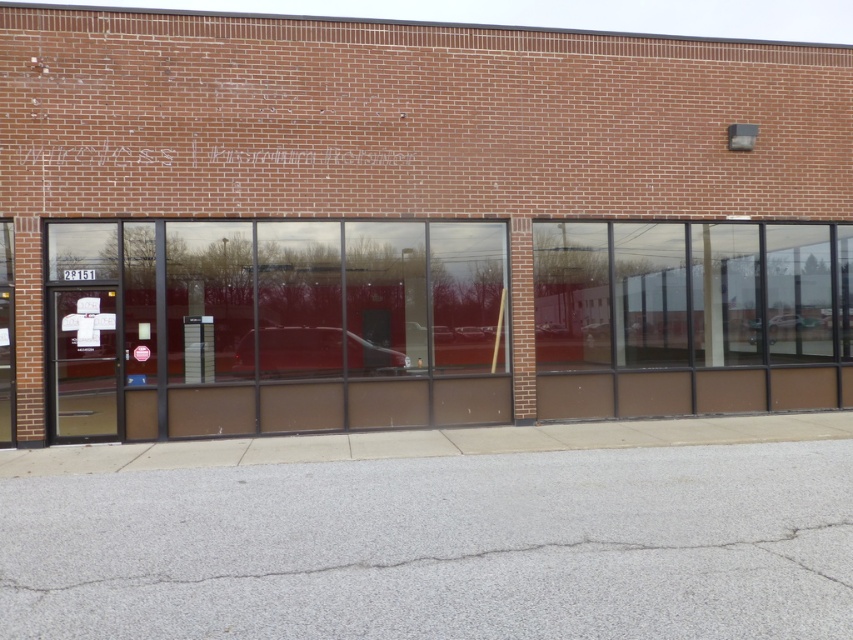
Question: Can you confirm if brown glass storefront at center is positioned below clear glass door at left?

Choices:
 (A) no
 (B) yes

Answer: (A)

Question: Which object is closer to the camera taking this photo?

Choices:
 (A) clear glass door at left
 (B) brown glass storefront at center

Answer: (B)

Question: Among these objects, which one is nearest to the camera?

Choices:
 (A) clear glass door at left
 (B) brown glass storefront at center

Answer: (B)

Question: Among these objects, which one is farthest from the camera?

Choices:
 (A) brown glass storefront at center
 (B) clear glass door at left

Answer: (B)

Question: Is brown glass storefront at center to the left of clear glass door at left from the viewer's perspective?

Choices:
 (A) yes
 (B) no

Answer: (B)

Question: Does brown glass storefront at center appear under clear glass door at left?

Choices:
 (A) no
 (B) yes

Answer: (A)